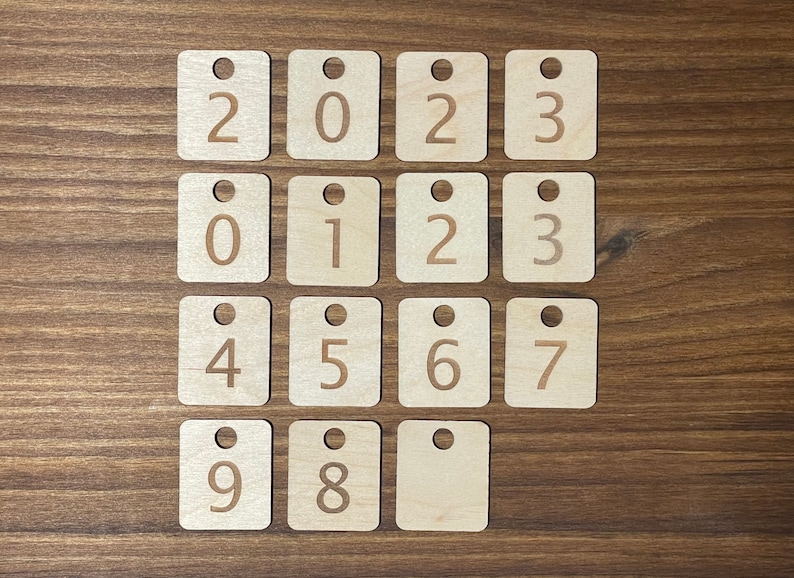
This screenshot has height=578, width=794. Find the location of `wood grain`. wood grain is located at coordinates (76, 194).